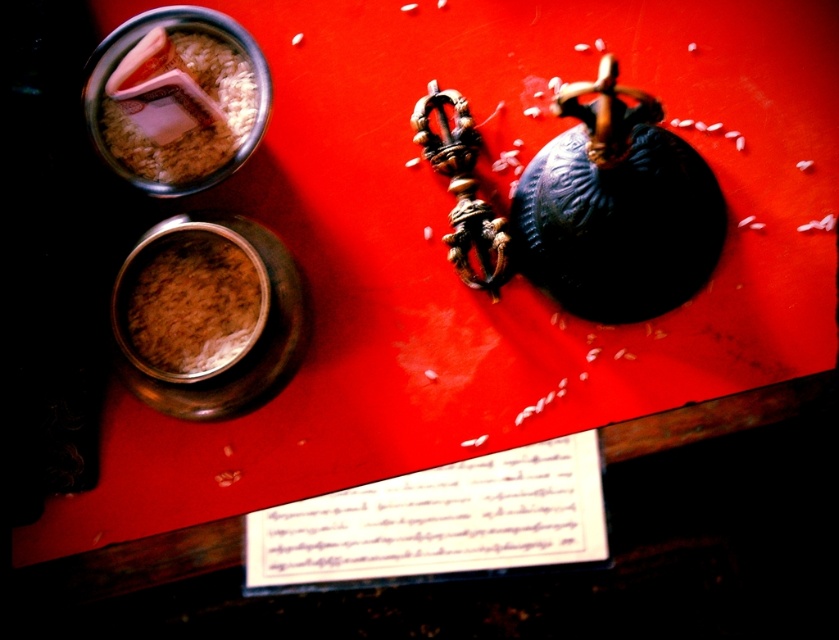
Question: Which object is closer to the camera taking this photo?

Choices:
 (A) white matte rice at upper left
 (B) brown matte powder at center

Answer: (A)

Question: Is the position of white matte rice at upper left less distant than that of brown matte powder at center?

Choices:
 (A) yes
 (B) no

Answer: (A)

Question: Can you confirm if white matte rice at upper left is smaller than brown matte powder at center?

Choices:
 (A) no
 (B) yes

Answer: (A)

Question: Does white matte rice at upper left appear under brown matte powder at center?

Choices:
 (A) yes
 (B) no

Answer: (B)

Question: Among these objects, which one is nearest to the camera?

Choices:
 (A) brown matte powder at center
 (B) white matte rice at upper left

Answer: (B)